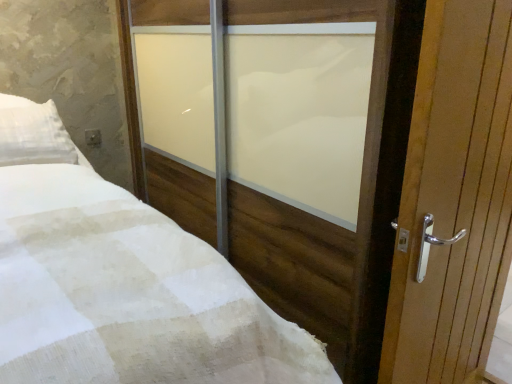
Where is `white checkered fabric at center`? Image resolution: width=512 pixels, height=384 pixels. white checkered fabric at center is located at coordinates (127, 294).

Image resolution: width=512 pixels, height=384 pixels. What do you see at coordinates (127, 294) in the screenshot?
I see `white checkered fabric at center` at bounding box center [127, 294].

Image resolution: width=512 pixels, height=384 pixels. Find the location of `white checkered fabric at center`. white checkered fabric at center is located at coordinates 127,294.